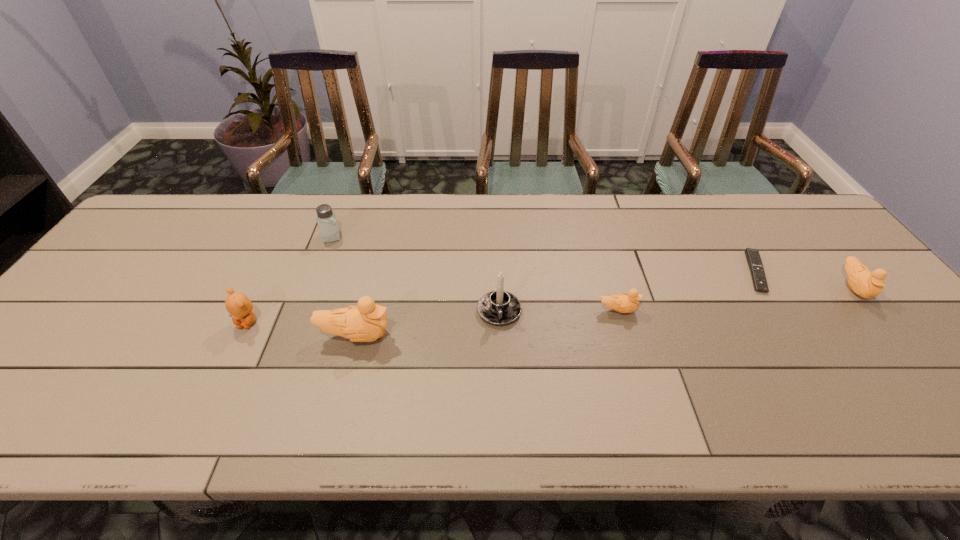
Identify the location of the tallest duckling. The width and height of the screenshot is (960, 540). (366, 322).

Where is `the nearest duckling`? The image size is (960, 540). the nearest duckling is located at coordinates (366, 322).

Find the location of a particular element. This screenshot has width=960, height=540. the shortest duckling is located at coordinates (624, 303).

Where is `the sixth tallest object`? The image size is (960, 540). the sixth tallest object is located at coordinates (624, 303).

Image resolution: width=960 pixels, height=540 pixels. I want to click on the second shortest duckling, so click(x=867, y=284).

This screenshot has height=540, width=960. I want to click on the rightmost object, so click(867, 284).

You are a GUI agent. You are given a task and a screenshot of the screen. Output one action in this format:
    pyautogui.click(x=<x>, y=<y>)
    Task: Click on the fourth object from left to right
    Image resolution: width=960 pixels, height=540 pixels.
    Given the screenshot: What is the action you would take?
    pyautogui.click(x=499, y=307)

I want to click on the farthest object, so pyautogui.click(x=329, y=229).

This screenshot has width=960, height=540. Identify the location of saltshaker. (329, 229).

At what (x,y) coordinates should I click in order to perform the action: click on the leftmost object. Please return your answer as a coordinate pair (x, y). Image resolution: width=960 pixels, height=540 pixels. Looking at the image, I should click on (239, 306).